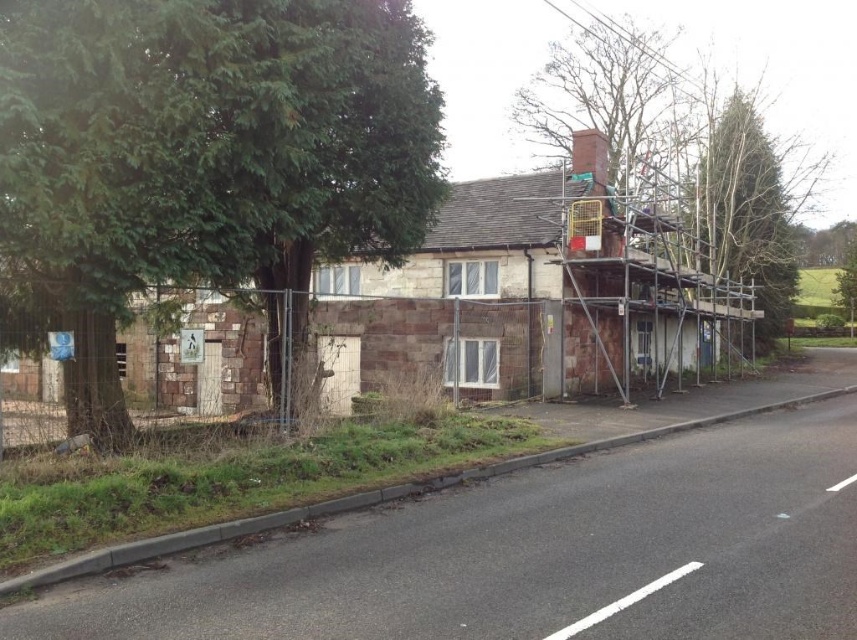
Which is in front, point (277, 346) or point (700, 250)?

Point (277, 346)

Looking at this image, is green leafy tree at left to the left of bare branches at upper center from the viewer's perspective?

Indeed, green leafy tree at left is positioned on the left side of bare branches at upper center.

Does point (154, 156) come farther from viewer compared to point (721, 144)?

No, it is not.

The height and width of the screenshot is (640, 857). What are the coordinates of `green leafy tree at left` in the screenshot? It's located at click(x=202, y=163).